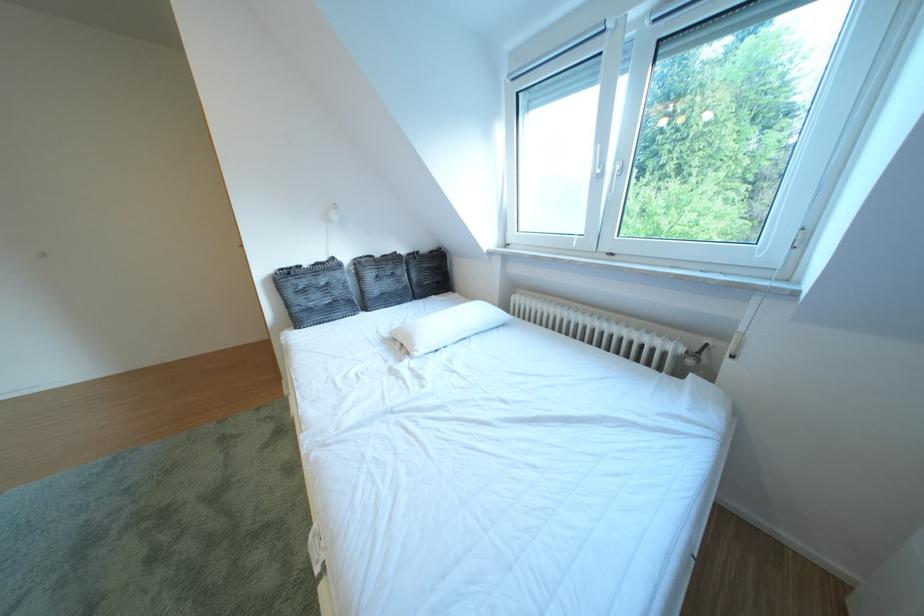
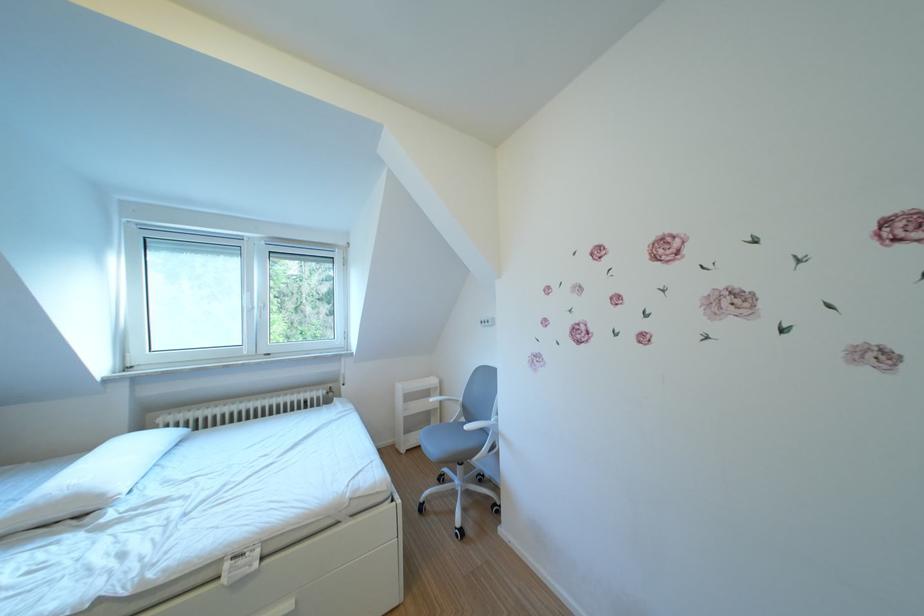
Find the pixel in the second image that matches point 616,169 in the first image.

(265, 307)